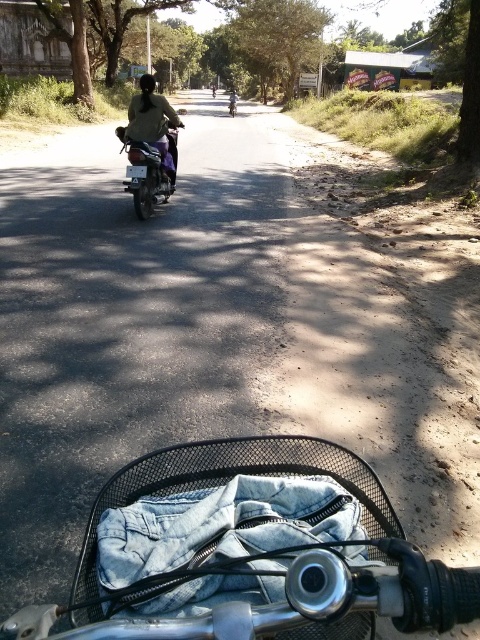
You are a rider on the metallic blue motorcycle at center. You notice a light brown fabric shirt at center in your basket. Can you tell if the shirt will fit in your jacket pocket without folding?

The metallic blue motorcycle at center has a larger size compared to light brown fabric shirt at center. Since the shirt is smaller than the motorcycle, it should fit in the jacket pocket without needing to fold it.

Looking at this image, you are riding a motorcycle and see the metallic blue motorcycle at center and the light brown fabric shirt at center in your view. Which object is located to the left?

The metallic blue motorcycle at center is positioned on the left side of light brown fabric shirt at center, so it is to the left.

You are a rider on a motorcycle and want to place your light brown fabric shirt at center into the black wire basket attached to the front of your metallic blue motorcycle at center. Can you fit the shirt into the basket?

The metallic blue motorcycle at center is 9.02 inches from light brown fabric shirt at center, so the shirt can be placed into the basket as they are close enough.